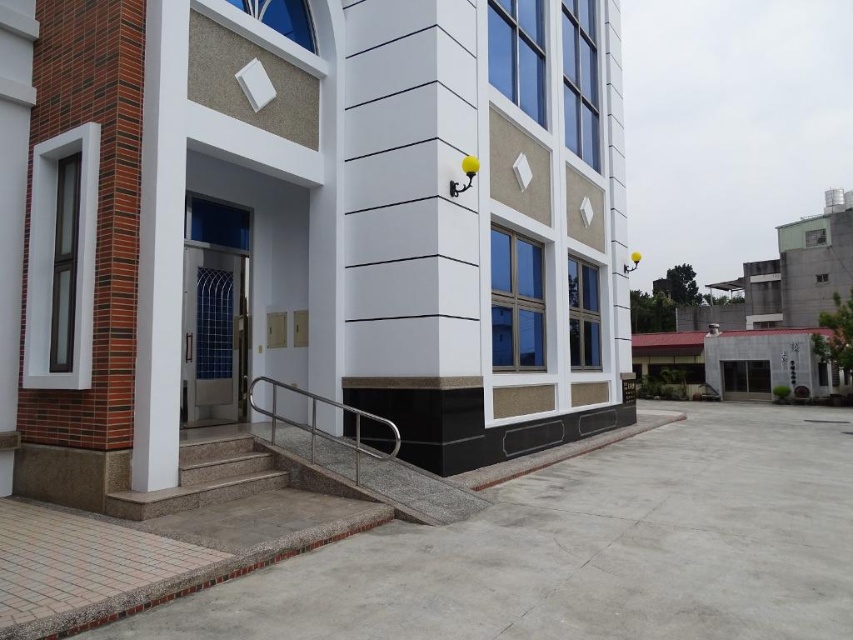
Image resolution: width=853 pixels, height=640 pixels. What do you see at coordinates (412, 227) in the screenshot? I see `white glossy wall lamp at center` at bounding box center [412, 227].

Who is higher up, white glossy wall lamp at center or granite steps at lower left?

Positioned higher is white glossy wall lamp at center.

Where is `white glossy wall lamp at center`? white glossy wall lamp at center is located at coordinates (412, 227).

Locate an element on the screen. The image size is (853, 640). white glossy wall lamp at center is located at coordinates (412, 227).

Does point (444, 240) come behind point (194, 244)?

That is False.

Is point (383, 148) less distant than point (231, 356)?

Yes, point (383, 148) is in front of point (231, 356).

Where is `white glossy wall lamp at center`? This screenshot has height=640, width=853. white glossy wall lamp at center is located at coordinates (412, 227).

How much distance is there between granite steps at lower left and satin silver railing at lower center?

granite steps at lower left is 6.57 feet from satin silver railing at lower center.

Find the location of `granite steps at lower left`. granite steps at lower left is located at coordinates (244, 499).

Which is in front, point (276, 508) or point (387, 422)?

Positioned in front is point (276, 508).

What are the coordinates of `granite steps at lower left` in the screenshot? It's located at (244, 499).